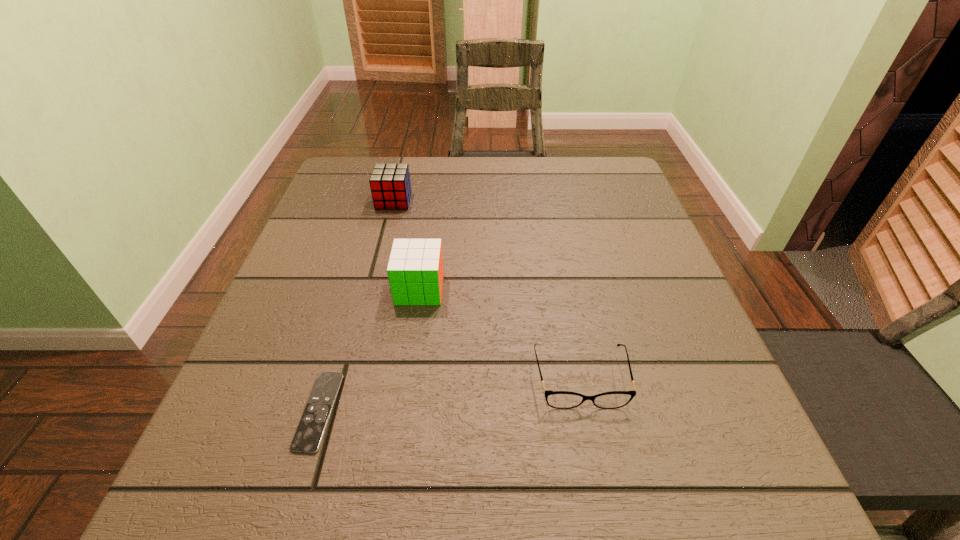
In order to click on vacant space that's between the second shortest object and the second object from right to left in this screenshot , I will do `click(500, 334)`.

Image resolution: width=960 pixels, height=540 pixels. What are the coordinates of `free point between the nearer cube and the rightmost object` in the screenshot? It's located at (500, 334).

Find the location of a particular element. The height and width of the screenshot is (540, 960). unoccupied area between the shortest object and the spectacles is located at coordinates (449, 395).

Locate which object is the second closest to the rightmost object. Please provide its 2D coordinates. Your answer should be formatted as a tuple, i.e. [(x, y)], where the tuple contains the x and y coordinates of a point satisfying the conditions above.

[(310, 431)]

Locate an element on the screen. The height and width of the screenshot is (540, 960). object that stands as the second closest to the second farthest object is located at coordinates (556, 399).

At what (x,y) coordinates should I click in order to perform the action: click on free space that satisfies the following two spatial constraints: 1. on the front side of the third nearest object; 2. on the right side of the farther cube. Please return your answer as a coordinate pair (x, y). This screenshot has height=540, width=960. Looking at the image, I should click on point(372,289).

In order to click on vacant region that satisfies the following two spatial constraints: 1. on the back side of the right cube; 2. on the left side of the remote control in this screenshot , I will do `click(355, 289)`.